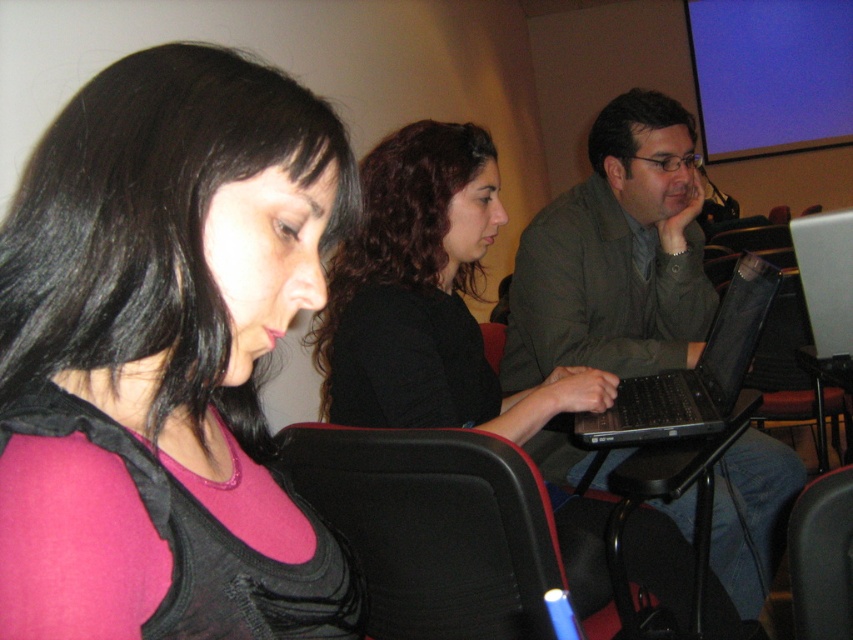
You are organizing a small event and need to determine seating arrangements. You have a limited space and want to know if the matte gray jacket at center and the black leather chair at lower right can fit side by side in a 1.5 meter wide space. Based on their widths, can they fit together?

The matte gray jacket at center is wider than the black leather chair at lower right. However, since the total width of both items combined is not provided, it is impossible to determine if they can fit into the 1.5 meter space without additional information.

You are standing in the conference room and need to reach both the point at coordinates point [163,406] and point [753,592]. Which point should you approach first to minimize the total distance walked?

You should approach point [163,406] first because it is closer to you than point [753,592], so reaching it first minimizes the total distance walked.